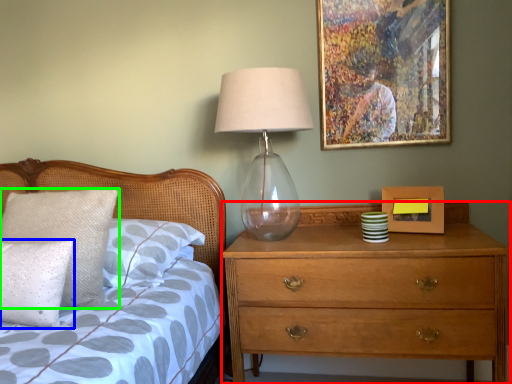
Question: Based on their relative distances, which object is farther from chest of drawers (highlighted by a red box)? Choose from pillow (highlighted by a blue box) and pillow (highlighted by a green box).

Choices:
 (A) pillow
 (B) pillow

Answer: (A)